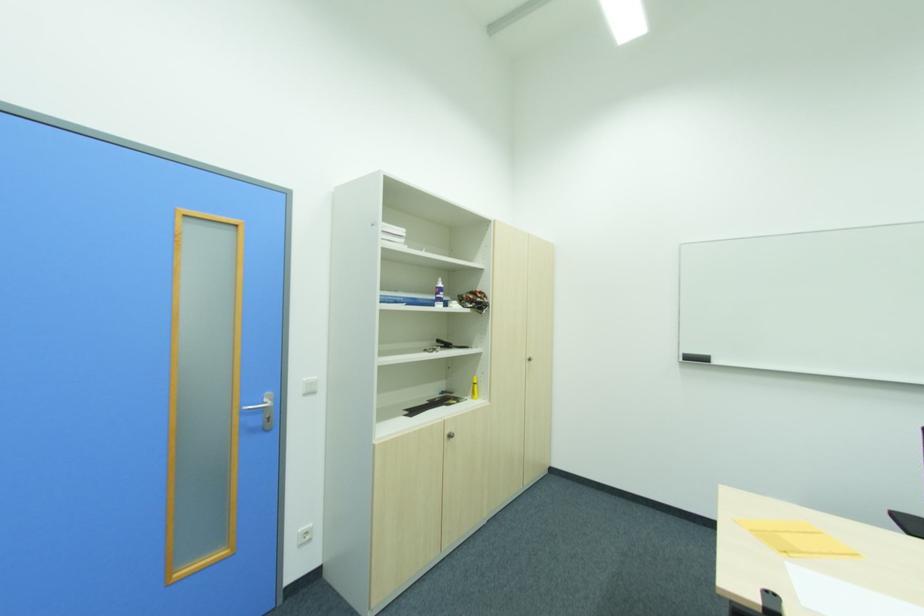
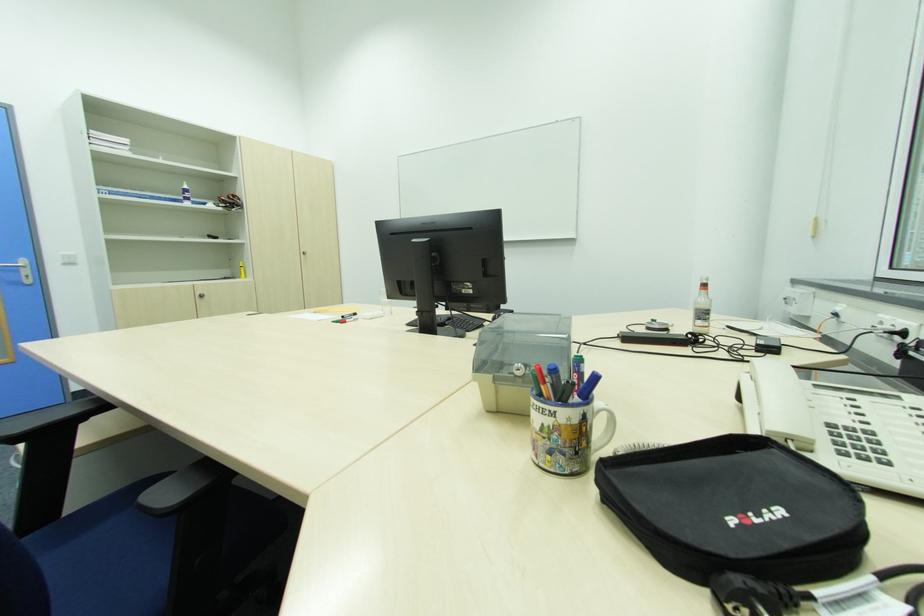
The point at (309, 379) is marked in the first image. Where is the corresponding point in the second image?

(64, 254)